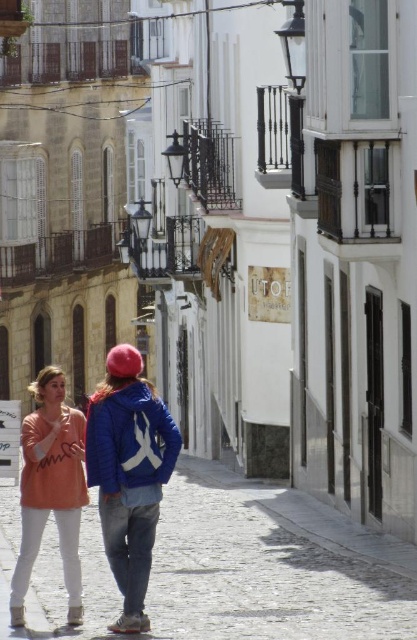
You are standing on the cobblestone street in the historic town and see two points marked on the buildings. Which point is closer to you, point (x=83, y=436) or point (x=163, y=468)?

Point (x=83, y=436) is further to the camera than point (x=163, y=468), so point (x=163, y=468) is closer to you.

You are a delivery person carrying a large package that is as wide as the blue denim jacket at center. You need to walk along the cobblestone pavement at lower center. Will the pavement be wide enough for you to walk comfortably without stepping off the pavement?

The cobblestone pavement at lower center is wider than the blue denim jacket at center, so the pavement is wide enough for the delivery person to walk comfortably without stepping off the pavement.